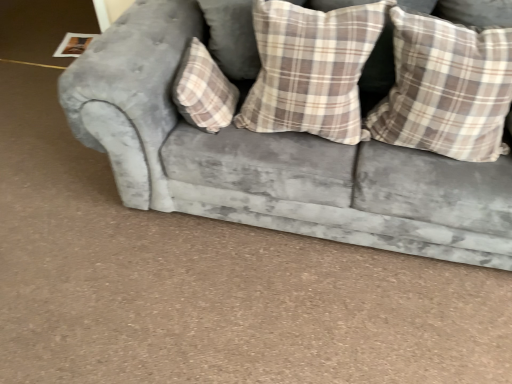
Question: Is velvet gray couch at center taller than plaid fabric pillow at center, positioned as the third pillow in right-to-left order?

Choices:
 (A) yes
 (B) no

Answer: (A)

Question: Is velvet gray couch at center facing towards plaid fabric pillow at center, the 1th pillow positioned from the left?

Choices:
 (A) no
 (B) yes

Answer: (B)

Question: Is velvet gray couch at center positioned far away from plaid fabric pillow at center, positioned as the third pillow in right-to-left order?

Choices:
 (A) no
 (B) yes

Answer: (A)

Question: Is velvet gray couch at center smaller than plaid fabric pillow at center, the 1th pillow positioned from the left?

Choices:
 (A) no
 (B) yes

Answer: (A)

Question: Considering the relative sizes of velvet gray couch at center and plaid fabric pillow at center, positioned as the third pillow in right-to-left order, in the image provided, is velvet gray couch at center thinner than plaid fabric pillow at center, positioned as the third pillow in right-to-left order,?

Choices:
 (A) no
 (B) yes

Answer: (A)

Question: Considering the positions of plaid fabric pillow at right, positioned as the 1th pillow in right-to-left order, and velvet gray couch at center in the image, is plaid fabric pillow at right, positioned as the 1th pillow in right-to-left order, bigger or smaller than velvet gray couch at center?

Choices:
 (A) small
 (B) big

Answer: (A)

Question: In the image, is plaid fabric pillow at right, positioned as the 1th pillow in right-to-left order, positioned in front of or behind velvet gray couch at center?

Choices:
 (A) front
 (B) behind

Answer: (B)

Question: From a real-world perspective, relative to velvet gray couch at center, is plaid fabric pillow at right, positioned as the 1th pillow in right-to-left order, vertically above or below?

Choices:
 (A) above
 (B) below

Answer: (A)

Question: From the image's perspective, is plaid fabric pillow at right, which appears as the 3th pillow when viewed from the left, located above or below velvet gray couch at center?

Choices:
 (A) above
 (B) below

Answer: (B)

Question: Considering the positions of velvet gray couch at center and plaid fabric pillow at center, arranged as the 2th pillow when viewed from the right, in the image, is velvet gray couch at center bigger or smaller than plaid fabric pillow at center, arranged as the 2th pillow when viewed from the right,?

Choices:
 (A) small
 (B) big

Answer: (B)

Question: Is point (342, 235) positioned closer to the camera than point (304, 125)?

Choices:
 (A) farther
 (B) closer

Answer: (A)

Question: In terms of width, does velvet gray couch at center look wider or thinner when compared to plaid fabric pillow at center, acting as the 2th pillow starting from the left?

Choices:
 (A) thin
 (B) wide

Answer: (B)

Question: From the image's perspective, is velvet gray couch at center located above or below plaid fabric pillow at center, arranged as the 2th pillow when viewed from the right?

Choices:
 (A) above
 (B) below

Answer: (B)

Question: In terms of width, does velvet gray couch at center look wider or thinner when compared to plaid fabric pillow at right, which appears as the 3th pillow when viewed from the left?

Choices:
 (A) wide
 (B) thin

Answer: (A)

Question: Is velvet gray couch at center taller or shorter than plaid fabric pillow at right, positioned as the 1th pillow in right-to-left order?

Choices:
 (A) short
 (B) tall

Answer: (B)